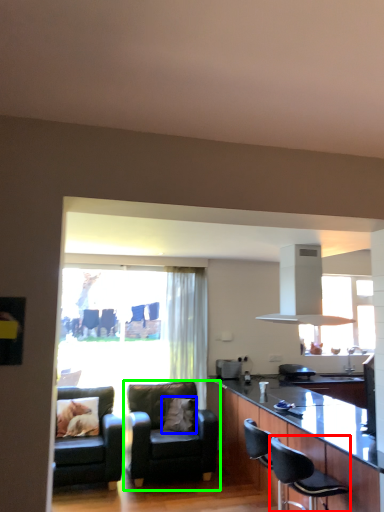
Question: Which object is positioned closest to chair (highlighted by a red box)? Select from pillow (highlighted by a blue box) and chair (highlighted by a green box).

Choices:
 (A) pillow
 (B) chair

Answer: (B)